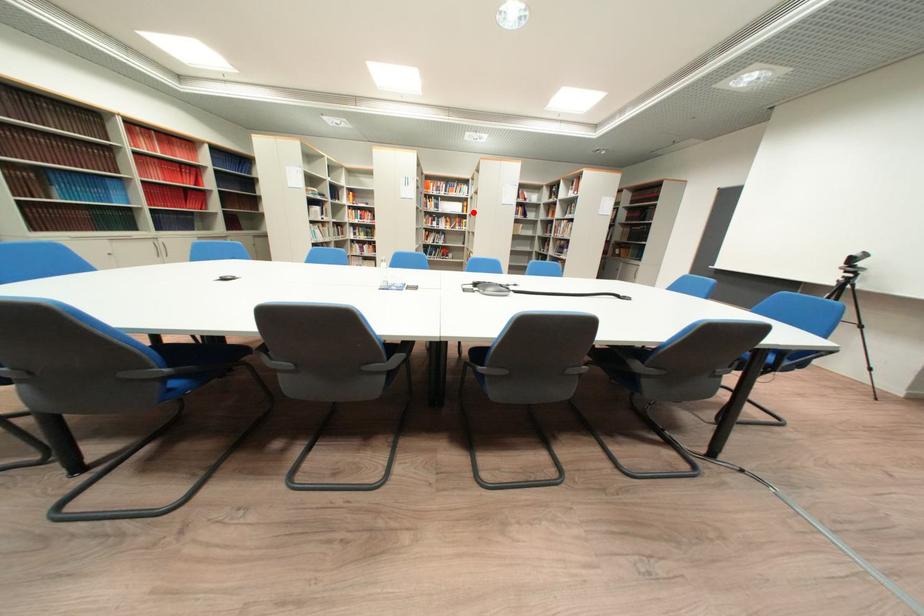
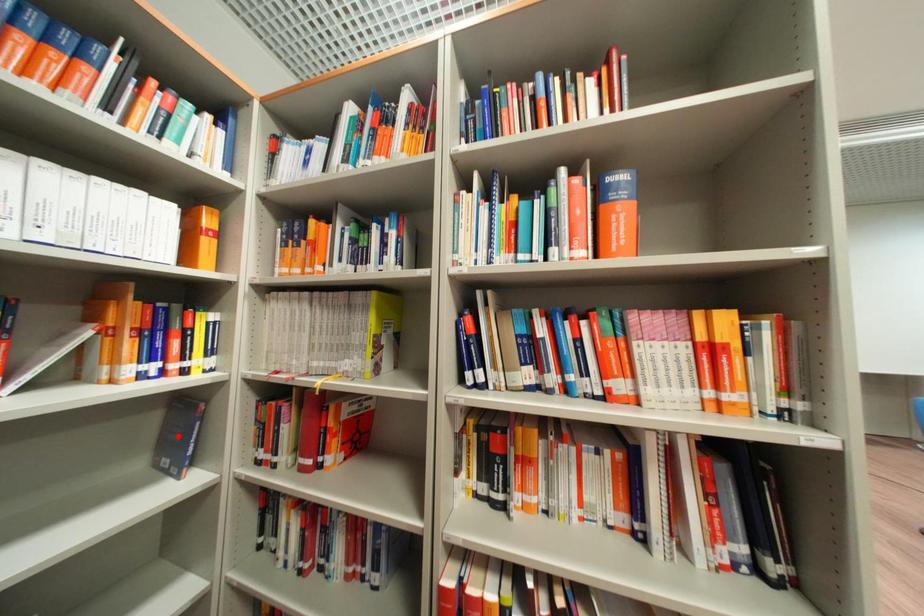
In the scene shown: I am providing you with two images of the same scene from different viewpoints. A red point is marked on the first image and another point is marked on the second image. Is the marked point in image1 the same physical position as the marked point in image2?

No